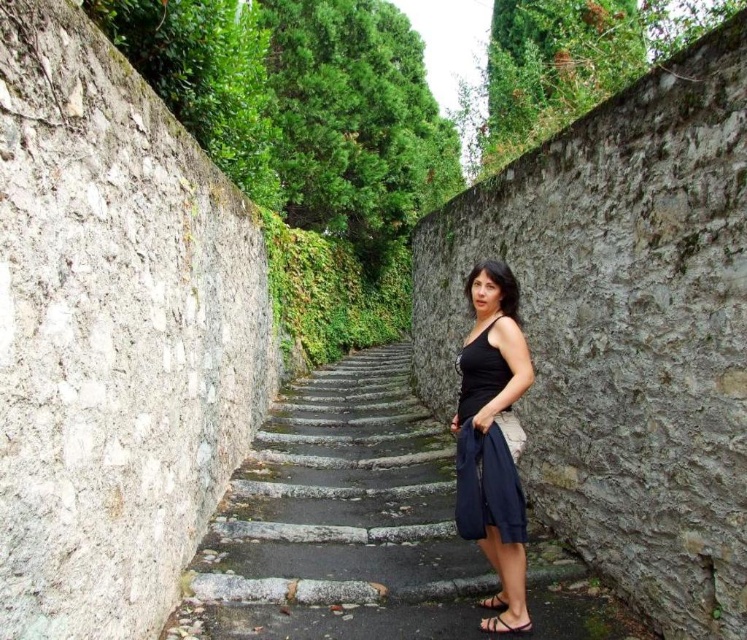
Is black satin dress at center further to camera compared to black leather sandal at lower center?

No.

Which is in front, point (468, 365) or point (498, 609)?

Point (498, 609)

The height and width of the screenshot is (640, 747). Identify the location of black satin dress at center. (483, 451).

Is the position of black satin dress at center less distant than that of brown leather sandal at lower center?

Yes, black satin dress at center is in front of brown leather sandal at lower center.

Is black satin dress at center bigger than brown leather sandal at lower center?

Yes.

In the scene shown: Who is more forward, (480, 465) or (521, 630)?

Point (521, 630) is in front.

This screenshot has width=747, height=640. Identify the location of black satin dress at center. (483, 451).

Is brown leather sandal at lower center shorter than black leather sandal at lower center?

Yes.

This screenshot has width=747, height=640. I want to click on brown leather sandal at lower center, so click(503, 625).

Locate an element on the screen. brown leather sandal at lower center is located at coordinates (503, 625).